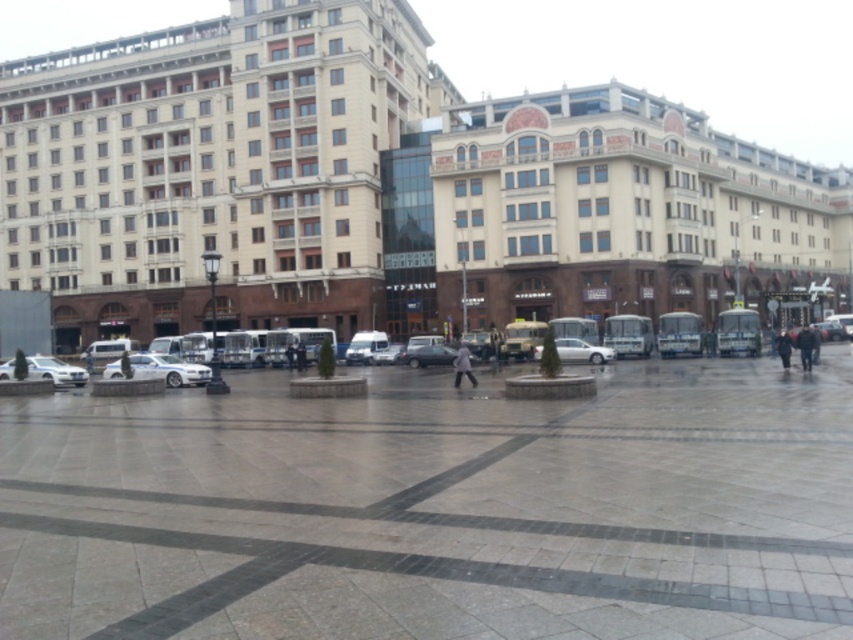
Between point (387, 355) and point (776, 336), which one is positioned in front?

Point (776, 336) is in front.

Can you confirm if metallic silver sedan at center is wider than dark gray jacket at center?

No.

The height and width of the screenshot is (640, 853). What are the coordinates of `metallic silver sedan at center` in the screenshot? It's located at (387, 355).

Which is in front, point (44, 378) or point (802, 353)?

Positioned in front is point (802, 353).

Which is behind, point (44, 365) or point (811, 358)?

Positioned behind is point (44, 365).

Where is `silver metallic car at lower left`? The image size is (853, 640). silver metallic car at lower left is located at coordinates (55, 371).

Looking at this image, which is more to the right, silver metallic car at center or white matte car at center?

Positioned to the right is white matte car at center.

Looking at this image, which of these two, silver metallic car at center or white matte car at center, stands taller?

Standing taller between the two is white matte car at center.

Where is `silver metallic car at center`? silver metallic car at center is located at coordinates (167, 369).